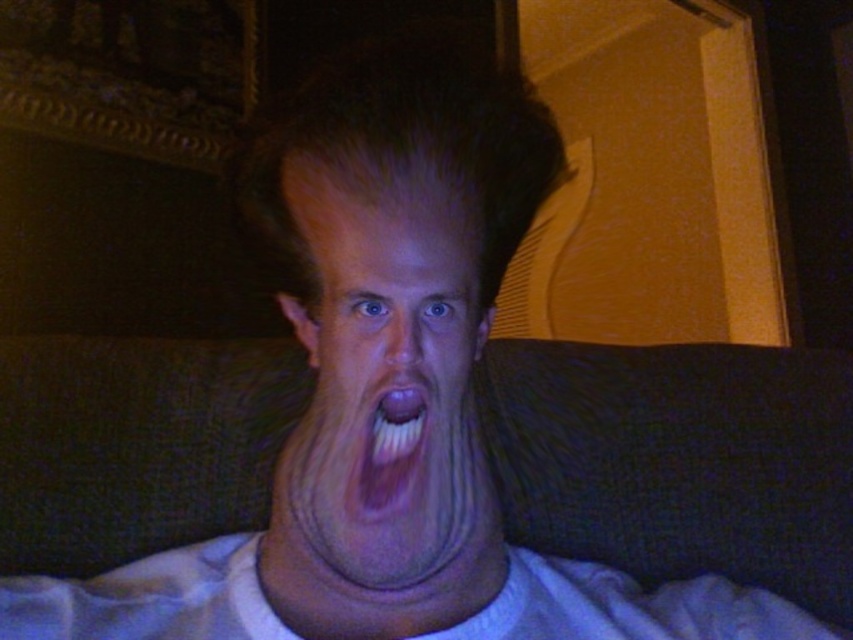
Question: Can you confirm if smooth skin face at center is wider than smooth flesh nose at center?

Choices:
 (A) yes
 (B) no

Answer: (A)

Question: Can you confirm if smooth skin face at center is positioned to the right of smooth flesh nose at center?

Choices:
 (A) yes
 (B) no

Answer: (B)

Question: Which point is closer to the camera taking this photo?

Choices:
 (A) (379, 492)
 (B) (418, 321)
 (C) (369, 504)

Answer: (B)

Question: Does smooth skin face at center appear on the left side of smooth flesh nose at center?

Choices:
 (A) no
 (B) yes

Answer: (B)

Question: Which point is closer to the camera?

Choices:
 (A) smooth skin face at center
 (B) pink glossy tongue at center
 (C) smooth flesh nose at center

Answer: (A)

Question: Which of the following is the farthest from the observer?

Choices:
 (A) (421, 314)
 (B) (372, 433)

Answer: (B)